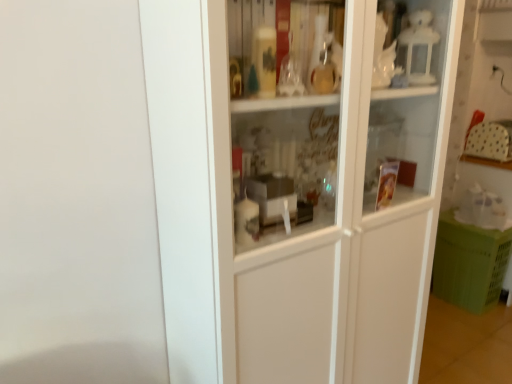
Question: Is green plastic crate at lower right thinner than white glossy cupboard at center?

Choices:
 (A) no
 (B) yes

Answer: (B)

Question: From the image's perspective, does green plastic crate at lower right appear higher than white glossy cupboard at center?

Choices:
 (A) yes
 (B) no

Answer: (B)

Question: Can you confirm if green plastic crate at lower right is bigger than white glossy cupboard at center?

Choices:
 (A) no
 (B) yes

Answer: (A)

Question: Is green plastic crate at lower right far away from white glossy cupboard at center?

Choices:
 (A) yes
 (B) no

Answer: (A)

Question: Is green plastic crate at lower right closer to camera compared to white glossy cupboard at center?

Choices:
 (A) no
 (B) yes

Answer: (A)

Question: Can you confirm if green plastic crate at lower right is positioned to the left of white glossy cupboard at center?

Choices:
 (A) no
 (B) yes

Answer: (A)

Question: Is white glossy cupboard at center beside green plastic crate at lower right?

Choices:
 (A) yes
 (B) no

Answer: (B)

Question: From the image's perspective, would you say white glossy cupboard at center is shown under green plastic crate at lower right?

Choices:
 (A) no
 (B) yes

Answer: (A)

Question: From the image's perspective, would you say white glossy cupboard at center is positioned over green plastic crate at lower right?

Choices:
 (A) yes
 (B) no

Answer: (A)

Question: Would you say green plastic crate at lower right is part of white glossy cupboard at center's contents?

Choices:
 (A) yes
 (B) no

Answer: (B)

Question: Considering the relative sizes of white glossy cupboard at center and green plastic crate at lower right in the image provided, is white glossy cupboard at center smaller than green plastic crate at lower right?

Choices:
 (A) no
 (B) yes

Answer: (A)

Question: From a real-world perspective, is white glossy cupboard at center under green plastic crate at lower right?

Choices:
 (A) yes
 (B) no

Answer: (B)

Question: Visually, is green plastic crate at lower right positioned to the left or to the right of white glossy cupboard at center?

Choices:
 (A) right
 (B) left

Answer: (A)